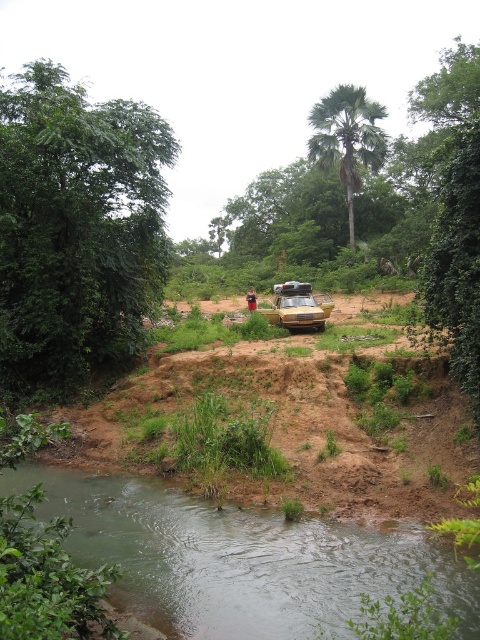
Question: Does brown sandy dirt field at center have a greater width compared to gold metallic car at center?

Choices:
 (A) yes
 (B) no

Answer: (A)

Question: Does green leafy tree at upper left appear over green leafy palm tree at upper center?

Choices:
 (A) yes
 (B) no

Answer: (B)

Question: Does brown sandy dirt field at center appear over gold metallic car at center?

Choices:
 (A) yes
 (B) no

Answer: (B)

Question: Which point is farther from the camera taking this photo?

Choices:
 (A) (336, 397)
 (B) (338, 154)

Answer: (B)

Question: Which object appears farthest from the camera in this image?

Choices:
 (A) green leafy tree at upper left
 (B) gold metallic car at center
 (C) brown sandy dirt field at center

Answer: (B)

Question: Which point is closer to the camera?

Choices:
 (A) green leafy palm tree at upper center
 (B) green leafy tree at upper left

Answer: (B)